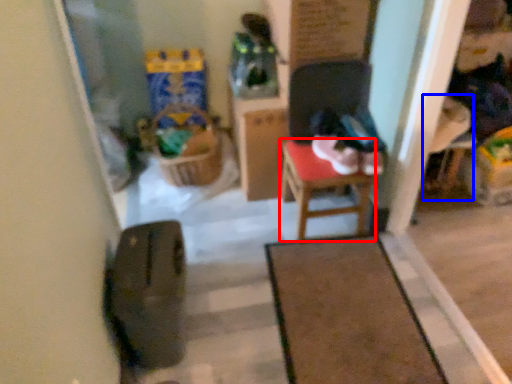
Question: Which object appears closest to the camera in this image, table (highlighted by a red box) or armchair (highlighted by a blue box)?

Choices:
 (A) table
 (B) armchair

Answer: (A)